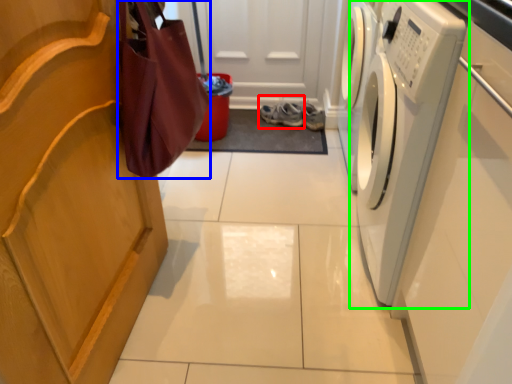
Question: Which is nearer to the footwear (highlighted by a red box)? shopping bag (highlighted by a blue box) or washing machine (highlighted by a green box).

Choices:
 (A) shopping bag
 (B) washing machine

Answer: (B)